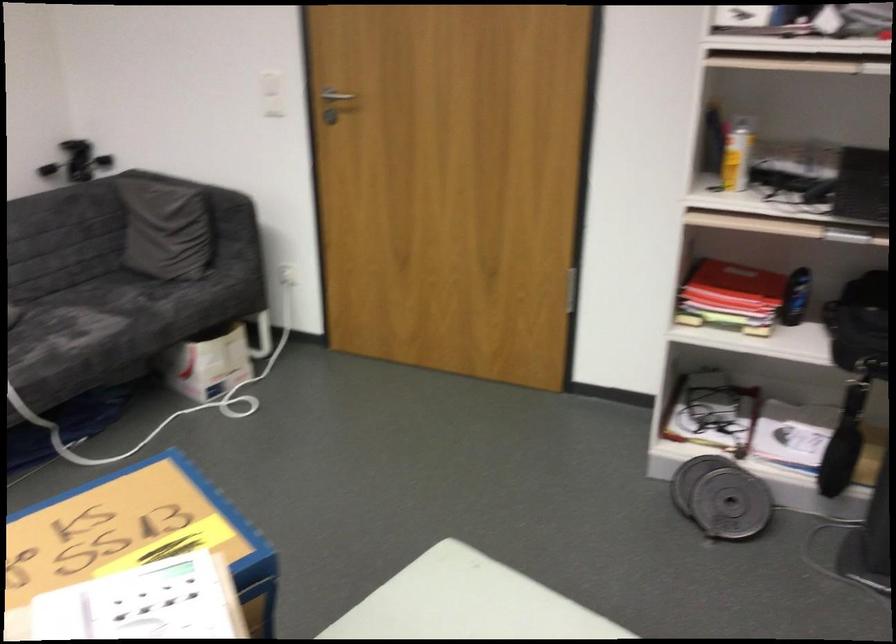
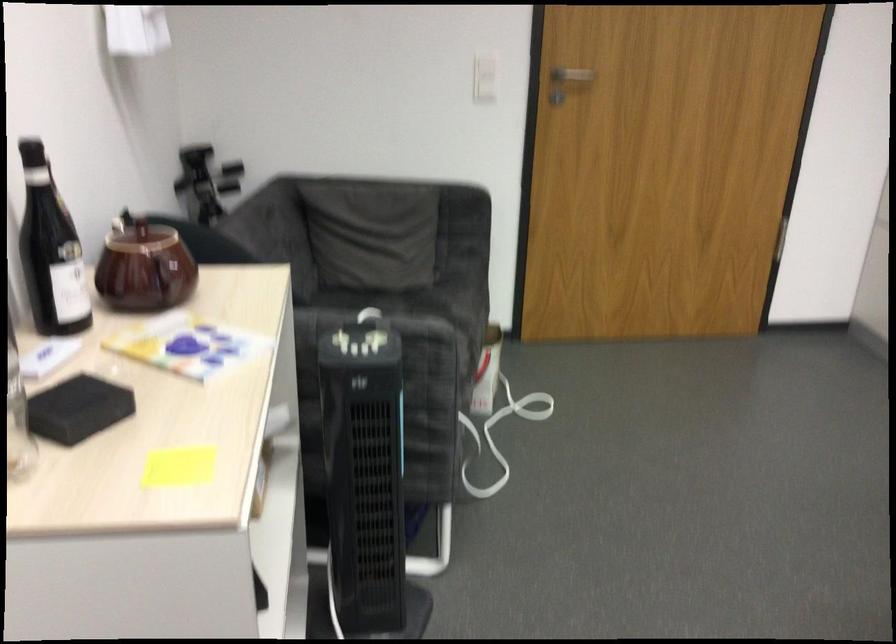
The point at (211, 182) is marked in the first image. Where is the corresponding point in the second image?

(388, 176)